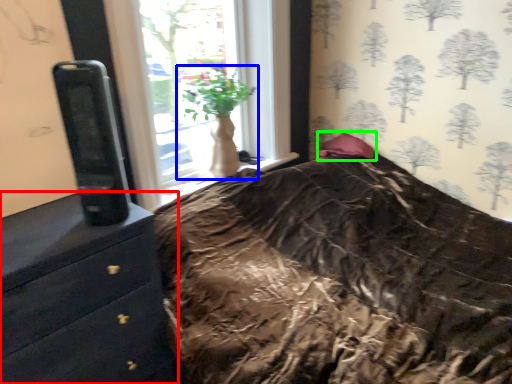
Question: Which is nearer to the chest of drawers (highlighted by a red box)? houseplant (highlighted by a blue box) or pillow (highlighted by a green box).

Choices:
 (A) houseplant
 (B) pillow

Answer: (A)